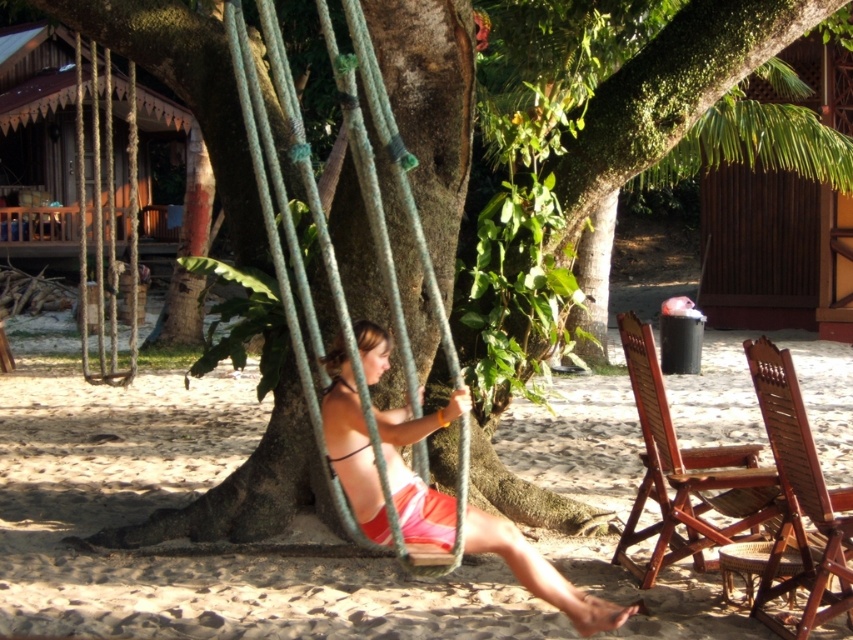
Can you confirm if rope swing at center is smaller than matte pink bikini at center?

Incorrect, rope swing at center is not smaller in size than matte pink bikini at center.

Can you confirm if rope swing at center is positioned to the right of matte pink bikini at center?

Incorrect, rope swing at center is not on the right side of matte pink bikini at center.

Who is more distant from viewer, (349, 136) or (402, 432)?

The point (402, 432) is behind.

Identify the location of rope swing at center. (376, 179).

Can you confirm if wooden textured beach chair at lower right is positioned to the right of wooden wicker beach chair at lower right?

Incorrect, wooden textured beach chair at lower right is not on the right side of wooden wicker beach chair at lower right.

Is wooden textured beach chair at lower right positioned behind wooden wicker beach chair at lower right?

Yes, wooden textured beach chair at lower right is further from the viewer.

Does point (683, 452) come behind point (827, 508)?

Yes, it is.

The height and width of the screenshot is (640, 853). I want to click on wooden textured beach chair at lower right, so click(x=685, y=474).

Which is behind, point (294, 147) or point (633, 321)?

The point (633, 321) is behind.

Which is in front, point (358, 17) or point (683, 497)?

Point (358, 17)

Find the location of `rope swing at center`. rope swing at center is located at coordinates (376, 179).